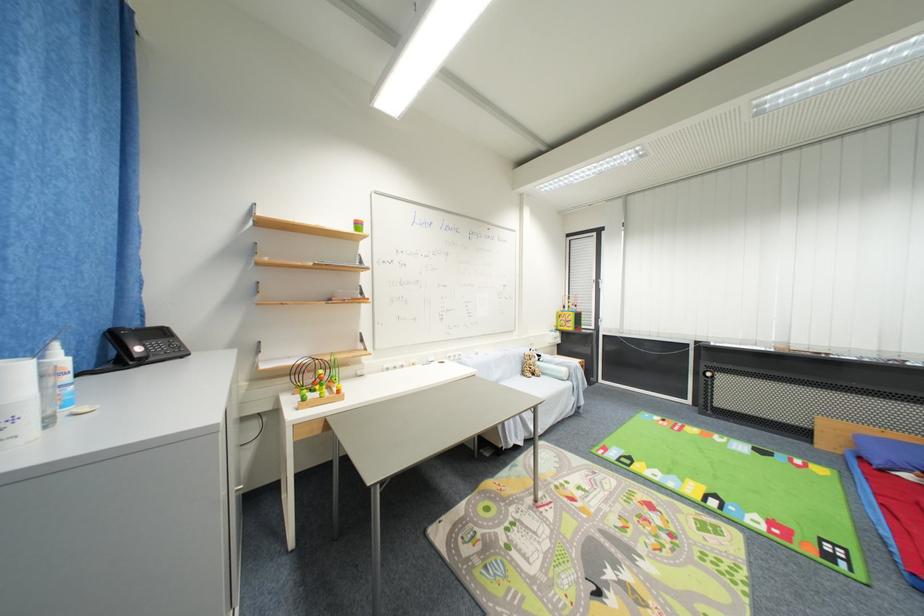
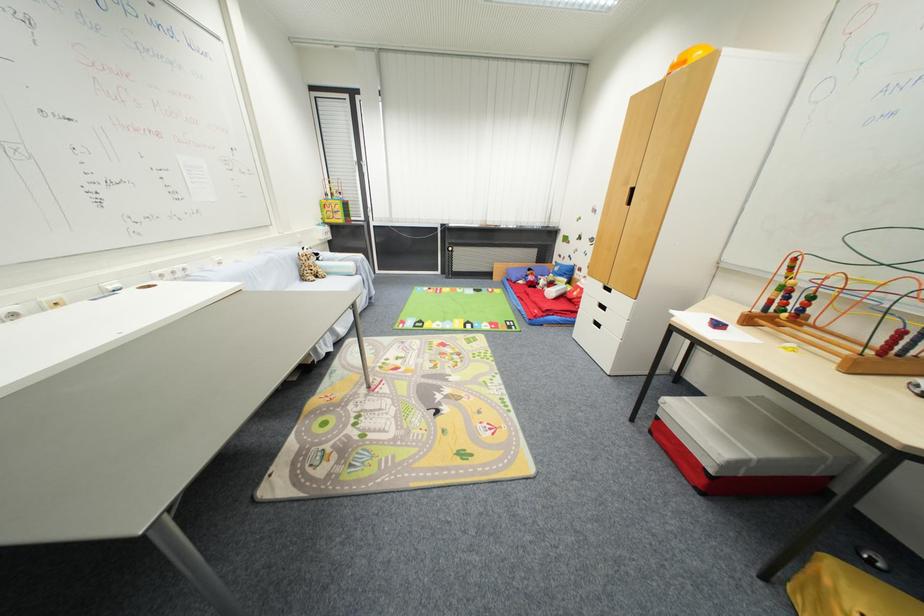
Locate, in the second image, the point that corresponds to the point at 578,400 in the first image.

(371, 293)